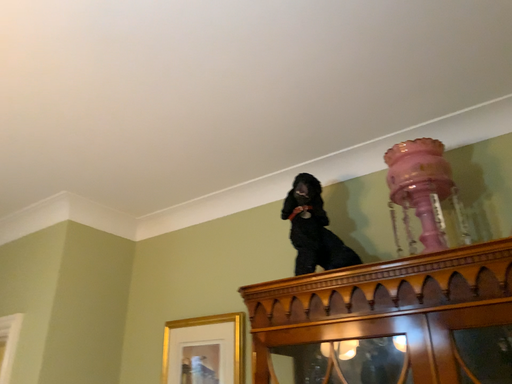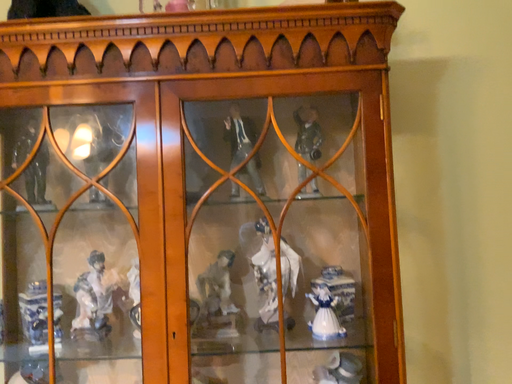
Question: Which way did the camera rotate in the video?

Choices:
 (A) rotated right
 (B) rotated left

Answer: (A)